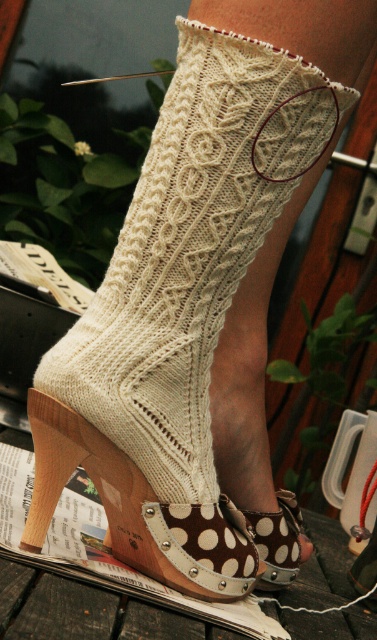
You are designing a display for a shoe store and need to arrange the brown polka dot fabric sandal at lower center and the brown polka dot fabric shoe at lower center on a shelf. Based on their widths, which one should be placed on the left side of the shelf to ensure they both fit without overlapping?

The brown polka dot fabric sandal at lower center might be wider than the brown polka dot fabric shoe at lower center, so placing the sandal on the left side would allow enough space for both items on the shelf.

You are trying to put on the brown polka dot fabric sandal at lower center. Based on the image, will the white knitted sock at center fit comfortably inside the sandal?

The white knitted sock at center might be wider than brown polka dot fabric sandal at lower center, so there is a possibility that the sock may not fit comfortably inside the sandal due to its width.

You are a fashion designer observing the image. You need to place a decorative ribbon between the white knitted sock at center and the brown polka dot fabric shoe at lower center. Since the sock is on the left of the shoe, where should you place the ribbon?

The white knitted sock at center is positioned on the left side of brown polka dot fabric shoe at lower center, so you should place the ribbon to the right of the sock and to the left of the shoe.